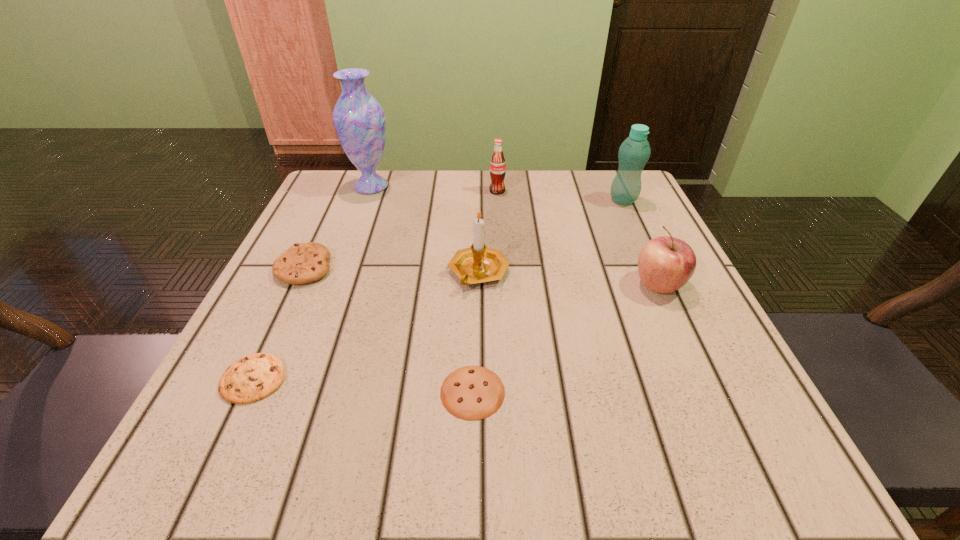
Locate an element on the screen. free space between the second shortest cookie and the apple is located at coordinates (456, 332).

I want to click on vacant space that's between the apple and the rightmost cookie, so click(x=565, y=339).

Find the location of a particular element. This screenshot has height=540, width=960. object that is the fourth closest one to the tallest cookie is located at coordinates (472, 392).

Identify which object is located as the sixth nearest to the soda. Please provide its 2D coordinates. Your answer should be formatted as a tuple, i.e. [(x, y)], where the tuple contains the x and y coordinates of a point satisfying the conditions above.

[(472, 392)]

Find the location of a particular element. The height and width of the screenshot is (540, 960). cookie that is the closest to the candle holder is located at coordinates (472, 392).

The height and width of the screenshot is (540, 960). In order to click on cookie that stands as the closest to the candle holder in this screenshot , I will do [x=472, y=392].

Locate an element on the screen. Image resolution: width=960 pixels, height=540 pixels. vacant space that satisfies the following two spatial constraints: 1. on the back side of the second shortest object; 2. on the right side of the vase is located at coordinates (344, 186).

At what (x,y) coordinates should I click in order to perform the action: click on free spot that satisfies the following two spatial constraints: 1. on the back side of the apple; 2. on the right side of the rightmost cookie. Please return your answer as a coordinate pair (x, y). This screenshot has height=540, width=960. Looking at the image, I should click on (474, 285).

Find the location of `vacant position in the image that satisfies the following two spatial constraints: 1. on the front side of the second shortest cookie; 2. on the right side of the shortest cookie`. vacant position in the image that satisfies the following two spatial constraints: 1. on the front side of the second shortest cookie; 2. on the right side of the shortest cookie is located at coordinates (248, 392).